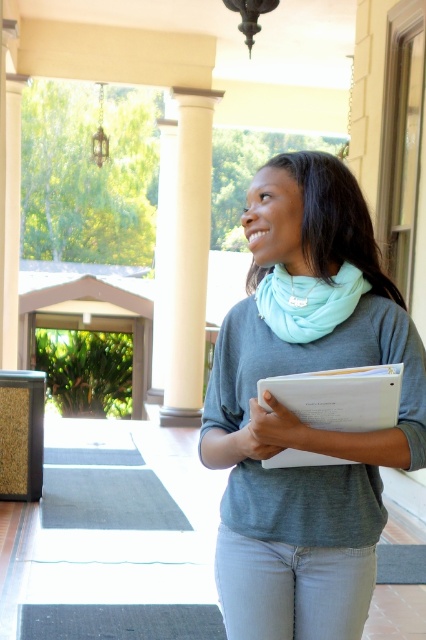
You are standing at point (357, 376) and want to walk to point (258, 618). Which direction should you move?

You should move forward since point (258, 618) is behind point (357, 376), meaning it is in the direction you are facing.

You are a photographer trying to capture both the gray matte scarf at center and the teal fabric scarf at center in a single frame. Since you want to highlight the contrast between their textures and colors, where should you position the camera relative to the person to ensure both scarves are fully visible?

Position the camera to the right side of the person so that the gray matte scarf at center on the left and the teal fabric scarf at center on the right are both visible in the frame, showcasing their contrasting textures and colors.